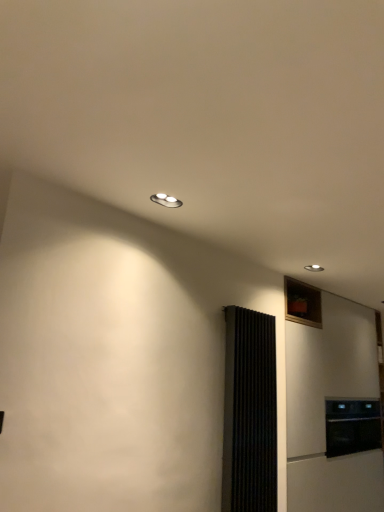
Question: Is the depth of black ribbed screen door at right less than that of black matte oven at lower right?

Choices:
 (A) yes
 (B) no

Answer: (A)

Question: Can you confirm if black ribbed screen door at right is positioned to the right of black matte oven at lower right?

Choices:
 (A) yes
 (B) no

Answer: (B)

Question: Is black ribbed screen door at right facing away from black matte oven at lower right?

Choices:
 (A) no
 (B) yes

Answer: (A)

Question: From the image's perspective, does black ribbed screen door at right appear higher than black matte oven at lower right?

Choices:
 (A) no
 (B) yes

Answer: (B)

Question: Considering the relative sizes of black ribbed screen door at right and black matte oven at lower right in the image provided, is black ribbed screen door at right smaller than black matte oven at lower right?

Choices:
 (A) yes
 (B) no

Answer: (A)

Question: Can we say black ribbed screen door at right lies outside black matte oven at lower right?

Choices:
 (A) yes
 (B) no

Answer: (A)

Question: From a real-world perspective, is white matte refrigerator at right over black ribbed screen door at right?

Choices:
 (A) no
 (B) yes

Answer: (A)

Question: Could you tell me if white matte refrigerator at right is facing black ribbed screen door at right?

Choices:
 (A) yes
 (B) no

Answer: (B)

Question: Is white matte refrigerator at right to the right of black ribbed screen door at right from the viewer's perspective?

Choices:
 (A) yes
 (B) no

Answer: (A)

Question: From a real-world perspective, is white matte refrigerator at right positioned under black ribbed screen door at right based on gravity?

Choices:
 (A) no
 (B) yes

Answer: (B)

Question: Is there a large distance between white matte refrigerator at right and black ribbed screen door at right?

Choices:
 (A) no
 (B) yes

Answer: (A)

Question: Can you confirm if white matte refrigerator at right is bigger than black ribbed screen door at right?

Choices:
 (A) yes
 (B) no

Answer: (A)

Question: Considering the relative sizes of black matte oven at lower right and black ribbed screen door at right in the image provided, is black matte oven at lower right smaller than black ribbed screen door at right?

Choices:
 (A) no
 (B) yes

Answer: (A)